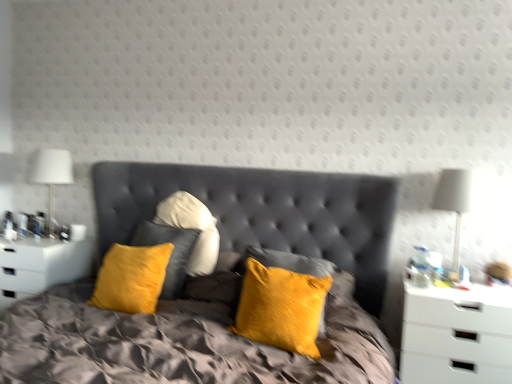
Question: Should I look upward or downward to see white matte nightstand at right, acting as the 1th nightstand starting from the front?

Choices:
 (A) up
 (B) down

Answer: (B)

Question: Is white fabric lampshade at left, which ranks as the first bedside lamp in back-to-front order, further to the viewer compared to white glossy nightstand at left, the 1th nightstand viewed from the left?

Choices:
 (A) no
 (B) yes

Answer: (B)

Question: Can you confirm if white fabric lampshade at left, which ranks as the first bedside lamp in back-to-front order, is shorter than white glossy nightstand at left, the second nightstand in the front-to-back sequence?

Choices:
 (A) no
 (B) yes

Answer: (A)

Question: Is white fabric lampshade at left, positioned as the second bedside lamp in right-to-left order, not within white glossy nightstand at left, marked as the first nightstand in a back-to-front arrangement?

Choices:
 (A) yes
 (B) no

Answer: (A)

Question: Does white fabric lampshade at left, which ranks as the first bedside lamp in back-to-front order, appear on the left side of white glossy nightstand at left, the 1th nightstand viewed from the left?

Choices:
 (A) yes
 (B) no

Answer: (B)

Question: Can you confirm if white fabric lampshade at left, which ranks as the first bedside lamp in back-to-front order, is positioned to the right of white glossy nightstand at left, the 2th nightstand in the right-to-left sequence?

Choices:
 (A) yes
 (B) no

Answer: (A)

Question: Is white fabric lampshade at left, the second bedside lamp viewed from the front, turned away from white glossy nightstand at left, the 2th nightstand in the right-to-left sequence?

Choices:
 (A) no
 (B) yes

Answer: (A)

Question: From a real-world perspective, does white fabric lampshade at right, which is the 2th bedside lamp from left to right, sit lower than velvet yellow pillows at center?

Choices:
 (A) no
 (B) yes

Answer: (A)

Question: Does white fabric lampshade at right, positioned as the first bedside lamp in front-to-back order, have a larger size compared to velvet yellow pillows at center?

Choices:
 (A) no
 (B) yes

Answer: (A)

Question: Considering the relative positions of white fabric lampshade at right, positioned as the first bedside lamp in front-to-back order, and velvet yellow pillows at center in the image provided, is white fabric lampshade at right, positioned as the first bedside lamp in front-to-back order, in front of velvet yellow pillows at center?

Choices:
 (A) no
 (B) yes

Answer: (A)

Question: Can you confirm if white fabric lampshade at right, positioned as the first bedside lamp in front-to-back order, is thinner than velvet yellow pillows at center?

Choices:
 (A) no
 (B) yes

Answer: (B)

Question: From the image's perspective, is white fabric lampshade at right, positioned as the first bedside lamp in front-to-back order, below velvet yellow pillows at center?

Choices:
 (A) no
 (B) yes

Answer: (A)

Question: Is white fabric lampshade at right, positioned as the first bedside lamp in right-to-left order, outside velvet yellow pillows at center?

Choices:
 (A) no
 (B) yes

Answer: (B)

Question: Is velvet yellow pillow at center turned away from white matte nightstand at right, acting as the 1th nightstand starting from the front?

Choices:
 (A) yes
 (B) no

Answer: (B)